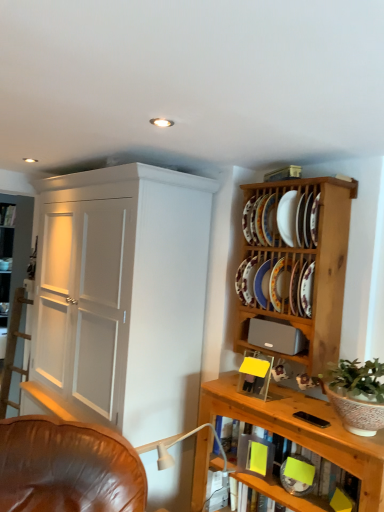
This screenshot has width=384, height=512. Identify the location of free spot above gray matte speaker at upper right (from a real-world perspective). (281, 319).